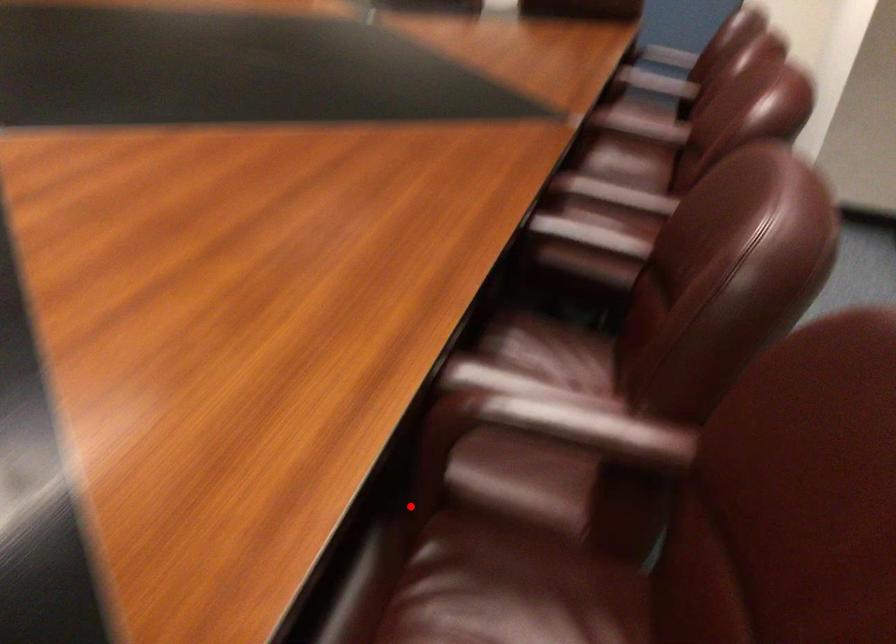
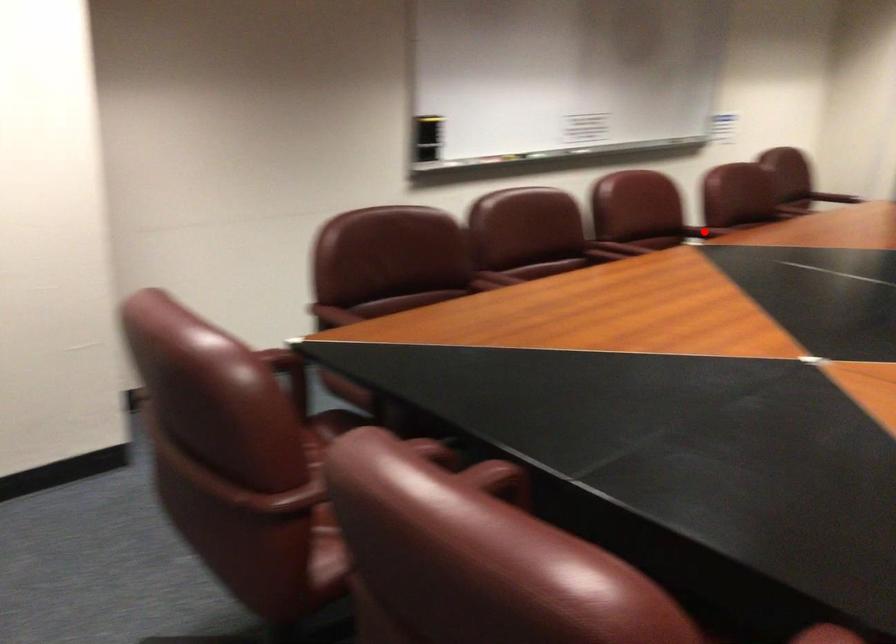
I am providing you with two images of the same scene from different viewpoints. A red point is marked on the first image and another point is marked on the second image. Is the marked point in image1 the same physical position as the marked point in image2?

No